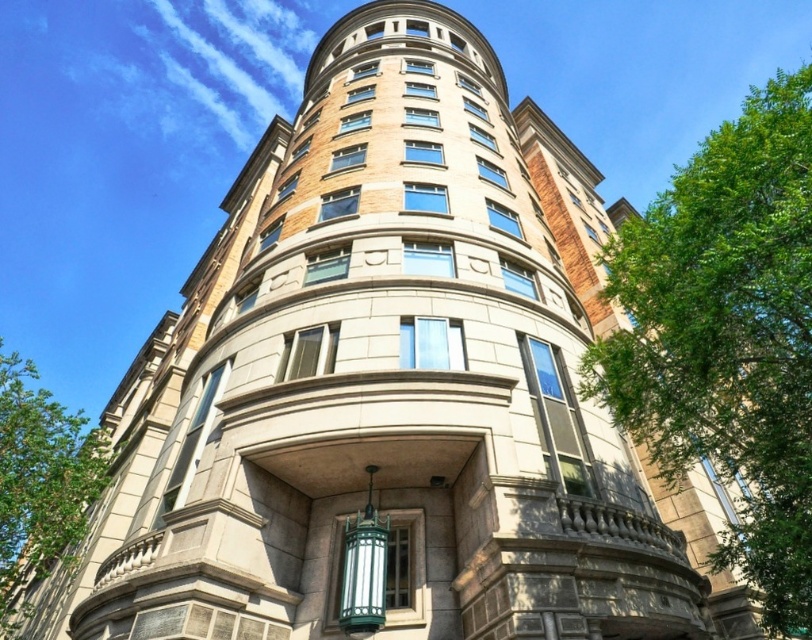
Between point (797, 326) and point (68, 413), which one is positioned in front?

Positioned in front is point (797, 326).

Who is positioned more to the left, green leafy tree at right or green leafy tree at lower left?

green leafy tree at lower left

Locate an element on the screen. The width and height of the screenshot is (812, 640). green leafy tree at right is located at coordinates pyautogui.click(x=726, y=337).

You are a GUI agent. You are given a task and a screenshot of the screen. Output one action in this format:
    pyautogui.click(x=<x>, y=<y>)
    Task: Click on the green leafy tree at right
    Image resolution: width=812 pixels, height=640 pixels.
    Given the screenshot: What is the action you would take?
    pyautogui.click(x=726, y=337)